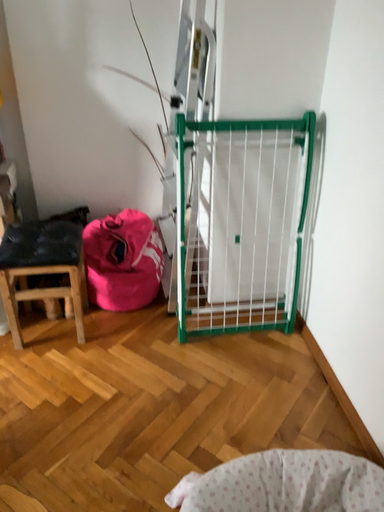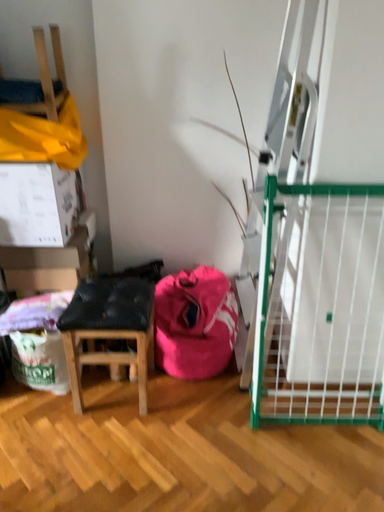
Question: How did the camera likely rotate when shooting the video?

Choices:
 (A) rotated left
 (B) rotated right

Answer: (A)